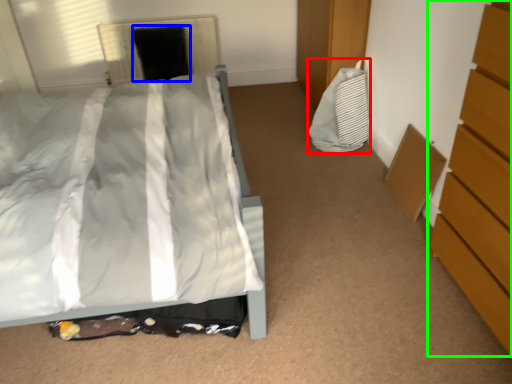
Question: Which object is the closest to the material (highlighted by a red box)? Choose among these: screen door (highlighted by a blue box) or chest of drawers (highlighted by a green box).

Choices:
 (A) screen door
 (B) chest of drawers

Answer: (B)